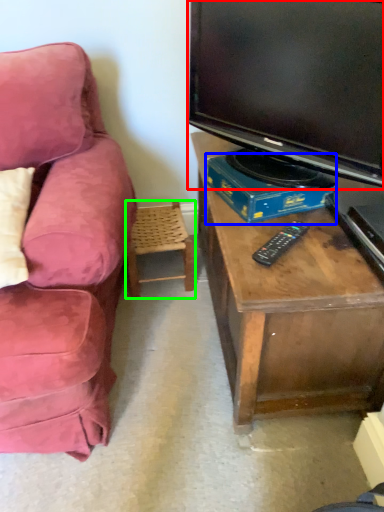
Question: Which object is the closest to the television (highlighted by a red box)? Choose among these: book (highlighted by a blue box) or chair (highlighted by a green box).

Choices:
 (A) book
 (B) chair

Answer: (A)